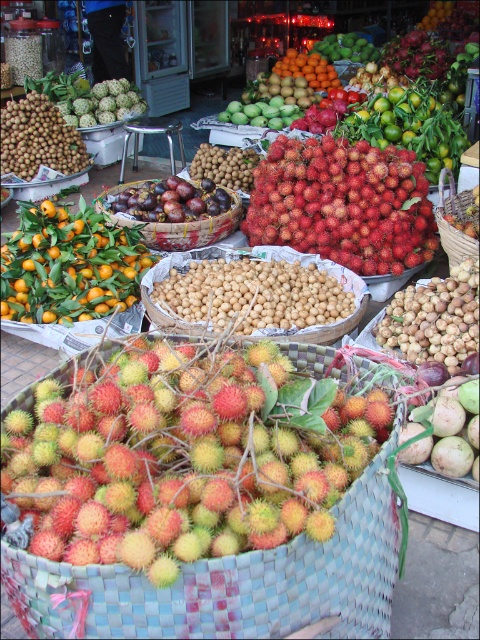
You are standing at the entrance of the fruit market and want to take a photo of two points in the scene. The first point is at coordinate point(404, 310) and the second is at point(203, 234). Which point will appear larger in your photo?

Point(404, 310) is closer to the camera than point(203, 234), so it will appear larger in the photo.

You are a customer at the fruit market and want to buy both the red matte rambutan at center and the green matte mango at center. If you start from the left side of the market, which fruit should you pick up first to follow the left to right order?

The red matte rambutan at center is to the left of the green matte mango at center, so you should pick up the red matte rambutan at center first to follow the left to right order.